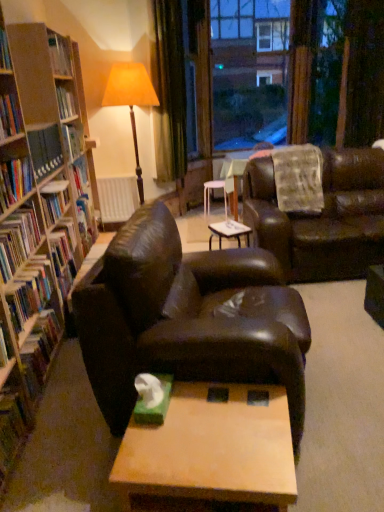
At what (x,y) coordinates should I click in order to perform the action: click on free space above wooden coffee table at center, acting as the second table starting from the back (from a real-world perspective). Please return your answer as a coordinate pair (x, y). The height and width of the screenshot is (512, 384). Looking at the image, I should click on (x=210, y=429).